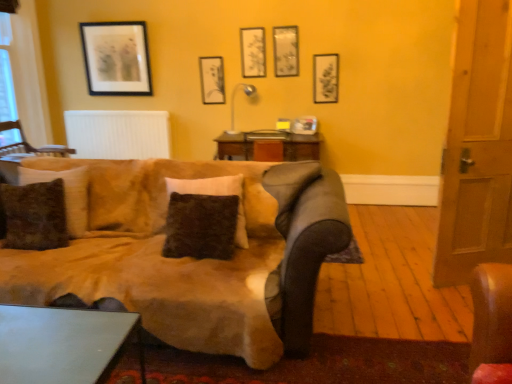
Measure the distance between wooden door at right and camera.

The distance of wooden door at right from camera is 7.53 feet.

This screenshot has height=384, width=512. Describe the element at coordinates (29, 144) in the screenshot. I see `wooden chair at left` at that location.

The image size is (512, 384). What do you see at coordinates (189, 258) in the screenshot? I see `suede-like beige couch at center` at bounding box center [189, 258].

What is the approximate height of suede-like beige couch at center?

It is 34.53 inches.

Measure the distance between point (233, 111) and camera.

Point (233, 111) and camera are 4.60 meters apart from each other.

Where is `white matte radiator at upper center`? This screenshot has height=384, width=512. white matte radiator at upper center is located at coordinates (118, 134).

Is matte black picture frame at upper center, the 3th picture frame viewed from the right, positioned with its back to metallic silver lamp at upper center?

No, metallic silver lamp at upper center is not at the back of matte black picture frame at upper center, the 3th picture frame viewed from the right.

Which object is positioned more to the right, matte black picture frame at upper center, the 3th picture frame viewed from the right, or metallic silver lamp at upper center?

matte black picture frame at upper center, the 3th picture frame viewed from the right.

Which point is more forward, [246,68] or [234,101]?

Positioned in front is point [246,68].

Based on the photo, what's the angular difference between matte black picture frame at upper center, acting as the 3th picture frame starting from the left, and metallic silver lamp at upper center's facing directions?

They differ by 1.36 degrees in their facing directions.

Is the surface of suede-like beige couch at center in direct contact with wooden chair at left?

No, suede-like beige couch at center is not making contact with wooden chair at left.

Which object is positioned more to the right, suede-like beige couch at center or wooden chair at left?

suede-like beige couch at center is more to the right.

Consider the image. Is suede-like beige couch at center positioned before wooden chair at left?

Yes.

Between suede-like beige couch at center and wooden chair at left, which one has smaller width?

Thinner between the two is wooden chair at left.

Which object is further away from the camera taking this photo, metallic silver lamp at upper center or matte black picture frame at upper left, which appears as the 1th picture frame when viewed from the left?

matte black picture frame at upper left, which appears as the 1th picture frame when viewed from the left, is more distant.

Between metallic silver lamp at upper center and matte black picture frame at upper left, which appears as the 1th picture frame when viewed from the left, which one has more height?

Standing taller between the two is matte black picture frame at upper left, which appears as the 1th picture frame when viewed from the left.

Which of these two, metallic silver lamp at upper center or matte black picture frame at upper left, which appears as the 1th picture frame when viewed from the left, is bigger?

metallic silver lamp at upper center.

From a real-world perspective, is metallic silver lamp at upper center positioned over matte black picture frame at upper left, which appears as the 1th picture frame when viewed from the left, based on gravity?

Incorrect, from a real-world perspective, metallic silver lamp at upper center is lower than matte black picture frame at upper left, which appears as the 1th picture frame when viewed from the left.

In terms of height, does matte black picture frame at upper center, the 3th picture frame viewed from the right, look taller or shorter compared to wooden chair at left?

In the image, matte black picture frame at upper center, the 3th picture frame viewed from the right, appears to be taller than wooden chair at left.

From a real-world perspective, is matte black picture frame at upper center, the 3th picture frame viewed from the right, beneath wooden chair at left?

Actually, matte black picture frame at upper center, the 3th picture frame viewed from the right, is physically above wooden chair at left in the real world.

Between matte black picture frame at upper center, the 3th picture frame viewed from the right, and wooden chair at left, which one is positioned behind?

Positioned behind is matte black picture frame at upper center, the 3th picture frame viewed from the right.

Consider the image. Is matte black picture frame at upper left, which appears as the 1th picture frame when viewed from the left, oriented towards matte black picture frame at upper center, acting as the 3th picture frame starting from the left?

No, matte black picture frame at upper left, which appears as the 1th picture frame when viewed from the left, is not aimed at matte black picture frame at upper center, acting as the 3th picture frame starting from the left.

Are matte black picture frame at upper left, which appears as the 1th picture frame when viewed from the left, and matte black picture frame at upper center, acting as the 3th picture frame starting from the left, located far from each other?

matte black picture frame at upper left, which appears as the 1th picture frame when viewed from the left, is far away from matte black picture frame at upper center, acting as the 3th picture frame starting from the left.

Is point (85, 64) closer or farther from the camera than point (263, 56)?

Point (85, 64) is farther from the camera than point (263, 56).

Does matte black picture frame at upper left, which ranks as the fifth picture frame in right-to-left order, have a lesser height compared to matte black picture frame at upper center, the 3th picture frame viewed from the right?

Incorrect, the height of matte black picture frame at upper left, which ranks as the fifth picture frame in right-to-left order, does not fall short of that of matte black picture frame at upper center, the 3th picture frame viewed from the right.

Could you tell me if matte black picture frame at upper left, which appears as the 1th picture frame when viewed from the left, is facing brown fuzzy pillow at left, marked as the second pillow in a right-to-left arrangement?

Yes.

Is matte black picture frame at upper left, which ranks as the fifth picture frame in right-to-left order, to the left of brown fuzzy pillow at left, positioned as the 1th pillow in left-to-right order, from the viewer's perspective?

Yes.

Between matte black picture frame at upper left, which appears as the 1th picture frame when viewed from the left, and brown fuzzy pillow at left, positioned as the 1th pillow in left-to-right order, which one has smaller width?

Thinner between the two is matte black picture frame at upper left, which appears as the 1th picture frame when viewed from the left.

Does matte black picture frame at upper left, which appears as the 1th picture frame when viewed from the left, have a greater height compared to brown fuzzy pillow at left, marked as the second pillow in a right-to-left arrangement?

Yes.

Is metallic gray table at lower left shorter than metallic silver lamp at upper center?

Correct, metallic gray table at lower left is not as tall as metallic silver lamp at upper center.

Looking at this image, is metallic gray table at lower left behind metallic silver lamp at upper center?

No, metallic gray table at lower left is closer to the camera.

Can you tell me how much metallic gray table at lower left and metallic silver lamp at upper center differ in facing direction?

1.87 degrees separate the facing orientations of metallic gray table at lower left and metallic silver lamp at upper center.

How distant is metallic gray table at lower left from metallic silver lamp at upper center?

A distance of 10.94 feet exists between metallic gray table at lower left and metallic silver lamp at upper center.

Find the location of a particular element. lamp lying in front of the matte black picture frame at upper center, acting as the 3th picture frame starting from the left is located at coordinates (234, 103).

I want to click on studio couch below the wooden chair at left (from a real-world perspective), so click(x=189, y=258).

When comparing their distances from matte black picture frame at upper center, which is the 2th picture frame from right to left, does suede-like beige couch at center or matte black picture frame at upper right, which ranks as the fifth picture frame in left-to-right order, seem further?

Among the two, suede-like beige couch at center is located further to matte black picture frame at upper center, which is the 2th picture frame from right to left.

Considering their positions, is metallic silver lamp at upper center positioned further to brown fuzzy pillow at left, marked as the second pillow in a right-to-left arrangement, than metallic gray table at lower left?

metallic silver lamp at upper center is positioned further to the anchor brown fuzzy pillow at left, marked as the second pillow in a right-to-left arrangement.

Considering their positions, is metallic silver lamp at upper center positioned further to matte black picture frame at upper left, which ranks as the fifth picture frame in right-to-left order, than matte black picture frame at upper center, which is the 2th picture frame from right to left?

matte black picture frame at upper center, which is the 2th picture frame from right to left, is further to matte black picture frame at upper left, which ranks as the fifth picture frame in right-to-left order.

From the image, which object appears to be nearer to wooden door at right, metallic gray table at lower left or metallic silver lamp at upper center?

Among the two, metallic gray table at lower left is located nearer to wooden door at right.

Which object lies nearer to the anchor point wooden chair at left, brown fuzzy pillow at left, marked as the second pillow in a right-to-left arrangement, or metallic gray table at lower left?

brown fuzzy pillow at left, marked as the second pillow in a right-to-left arrangement, lies closer to wooden chair at left than the other object.

From the image, which object appears to be nearer to brown fuzzy pillow at left, positioned as the 1th pillow in left-to-right order, wooden chair at left or wooden chair at left?

wooden chair at left lies closer to brown fuzzy pillow at left, positioned as the 1th pillow in left-to-right order, than the other object.

Based on their spatial positions, is metallic gray table at lower left or suede-like beige couch at center further from wooden chair at left?

The object further to wooden chair at left is metallic gray table at lower left.

From the image, which object appears to be nearer to brown fuzzy pillow at left, marked as the second pillow in a right-to-left arrangement, wooden chair at left or matte black picture frame at upper center, which ranks as the second picture frame in left-to-right order?

matte black picture frame at upper center, which ranks as the second picture frame in left-to-right order, is positioned closer to the anchor brown fuzzy pillow at left, marked as the second pillow in a right-to-left arrangement.

I want to click on picture frame between matte black picture frame at upper center, which ranks as the second picture frame in left-to-right order, and matte black picture frame at upper center, which is the 2th picture frame from right to left, in the horizontal direction, so click(253, 52).

You are a GUI agent. You are given a task and a screenshot of the screen. Output one action in this format:
    pyautogui.click(x=<x>, y=<y>)
    Task: Click on the pillow located between brown fuzzy pillow at left, positioned as the 1th pillow in left-to-right order, and wooden door at right in the left-right direction
    The image size is (512, 384).
    Given the screenshot: What is the action you would take?
    pyautogui.click(x=215, y=195)

Locate an element on the screen. The width and height of the screenshot is (512, 384). chair located between wooden chair at left and matte black picture frame at upper center, the 3th picture frame viewed from the right, in the left-right direction is located at coordinates (29, 144).

You are a GUI agent. You are given a task and a screenshot of the screen. Output one action in this format:
    pyautogui.click(x=<x>, y=<y>)
    Task: Click on the radiator between wooden chair at left and wooden door at right from left to right
    The width and height of the screenshot is (512, 384).
    Given the screenshot: What is the action you would take?
    pyautogui.click(x=118, y=134)